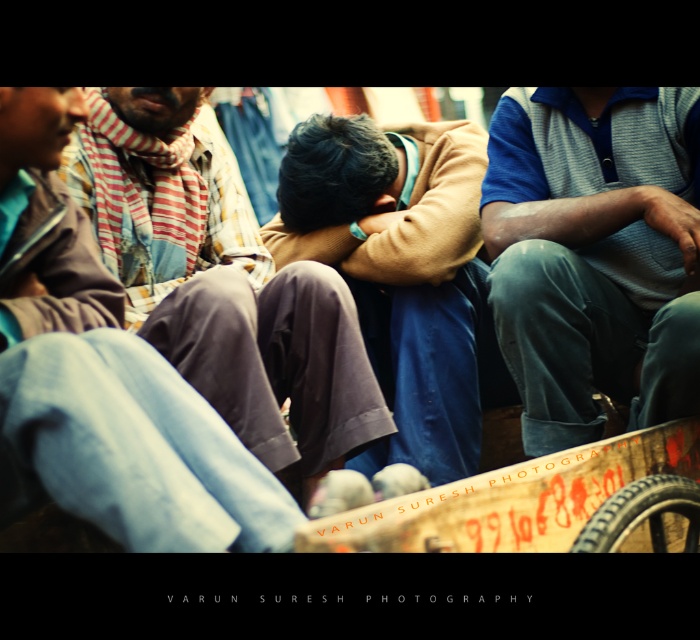
Does blue striped polo shirt at center have a greater height compared to brown woolen sweater at center?

No.

Which is above, blue striped polo shirt at center or brown woolen sweater at center?

brown woolen sweater at center is above.

Is point (567, 432) farther from viewer compared to point (312, 170)?

No, (567, 432) is in front of (312, 170).

Where is `blue striped polo shirt at center`? This screenshot has height=640, width=700. blue striped polo shirt at center is located at coordinates (595, 253).

Consider the image. Measure the distance between blue striped polo shirt at center and brown cotton shirt at center.

They are 7.76 meters apart.

Is blue striped polo shirt at center in front of brown cotton shirt at center?

Yes, blue striped polo shirt at center is in front of brown cotton shirt at center.

Which is in front, point (540, 336) or point (228, 282)?

Positioned in front is point (540, 336).

The image size is (700, 640). What are the coordinates of `blue striped polo shirt at center` in the screenshot? It's located at (595, 253).

Between point (126, 144) and point (396, 202), which one is positioned in front?

Point (126, 144) is more forward.

Does brown cotton shirt at center have a lesser width compared to brown woolen sweater at center?

Incorrect, brown cotton shirt at center's width is not less than brown woolen sweater at center's.

This screenshot has height=640, width=700. Identify the location of brown cotton shirt at center. (223, 285).

Locate an element on the screen. brown cotton shirt at center is located at coordinates (223, 285).